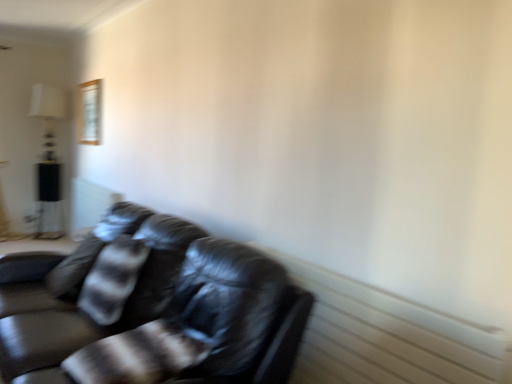
Measure the distance between point (83, 119) and camera.

The depth of point (83, 119) is 5.56 meters.

The width and height of the screenshot is (512, 384). What do you see at coordinates (89, 113) in the screenshot? I see `wooden frame at upper left` at bounding box center [89, 113].

The image size is (512, 384). I want to click on black glossy table at left, so click(x=47, y=187).

The image size is (512, 384). What do you see at coordinates (154, 309) in the screenshot? I see `shiny black leather couch at lower left` at bounding box center [154, 309].

Image resolution: width=512 pixels, height=384 pixels. What are the coordinates of `striped fabric pillow at left` in the screenshot? It's located at (94, 248).

Measure the distance between striped fabric pillow at left and camera.

The depth of striped fabric pillow at left is 2.49 meters.

The image size is (512, 384). I want to click on wooden frame at upper left, so click(89, 113).

Is shiny black leather couch at lower left far away from black glossy table at left?

shiny black leather couch at lower left is positioned a significant distance from black glossy table at left.

From the image's perspective, which is above, shiny black leather couch at lower left or black glossy table at left?

black glossy table at left, from the image's perspective.

In the image, there is a black glossy table at left. At what (x,y) coordinates should I click in order to perform the action: click on studio couch below it (from a real-world perspective). Please return your answer as a coordinate pair (x, y). This screenshot has height=384, width=512. Looking at the image, I should click on (154, 309).

From a real-world perspective, who is located higher, shiny black leather couch at lower left or black glossy table at left?

Answer: In real-world perspective, black glossy table at left is above.

How different are the orientations of black glossy table at left and wooden frame at upper left in degrees?

The facing directions of black glossy table at left and wooden frame at upper left are 56.6 degrees apart.

From a real-world perspective, is black glossy table at left located beneath wooden frame at upper left?

Yes, from a real-world perspective, black glossy table at left is under wooden frame at upper left.

Who is shorter, black glossy table at left or wooden frame at upper left?

wooden frame at upper left is shorter.

Does point (47, 170) come behind point (87, 89)?

Yes, point (47, 170) is farther from viewer.

How far apart are striped fabric pillow at left and black glossy table at left?

striped fabric pillow at left and black glossy table at left are 12.15 feet apart from each other.

Between point (57, 269) and point (46, 193), which one is positioned in front?

The point (57, 269) is closer.

Is striped fabric pillow at left next to black glossy table at left and touching it?

No.

Considering the sizes of objects striped fabric pillow at left and wooden frame at upper left in the image provided, who is shorter, striped fabric pillow at left or wooden frame at upper left?

striped fabric pillow at left.

Who is smaller, striped fabric pillow at left or wooden frame at upper left?

With smaller size is wooden frame at upper left.

Is striped fabric pillow at left surrounding wooden frame at upper left?

No, wooden frame at upper left is not surrounded by striped fabric pillow at left.

Looking at this image, how distant is striped fabric pillow at left from wooden frame at upper left?

striped fabric pillow at left and wooden frame at upper left are 8.17 feet apart.

Measure the distance between white fabric lampshade at upper left and wooden frame at upper left.

The distance of white fabric lampshade at upper left from wooden frame at upper left is 33.46 inches.

From a real-world perspective, is white fabric lampshade at upper left positioned under wooden frame at upper left based on gravity?

Yes, from a real-world perspective, white fabric lampshade at upper left is under wooden frame at upper left.

Is the surface of white fabric lampshade at upper left in direct contact with wooden frame at upper left?

They are not placed beside each other.

Is point (32, 88) less distant than point (95, 141)?

No, it is not.

Between wooden frame at upper left and shiny black leather couch at lower left, which one has larger size?

shiny black leather couch at lower left.

Is wooden frame at upper left turned away from shiny black leather couch at lower left?

wooden frame at upper left does not have its back to shiny black leather couch at lower left.

Is wooden frame at upper left inside or outside of shiny black leather couch at lower left?

wooden frame at upper left is not inside shiny black leather couch at lower left, it's outside.

From the image's perspective, is wooden frame at upper left located beneath shiny black leather couch at lower left?

Actually, wooden frame at upper left appears above shiny black leather couch at lower left in the image.

In the image, is black glossy table at left on the left side or the right side of white fabric lampshade at upper left?

black glossy table at left is positioned on white fabric lampshade at upper left's left side.

From the image's perspective, is black glossy table at left above white fabric lampshade at upper left?

Incorrect, from the image's perspective, black glossy table at left is lower than white fabric lampshade at upper left.

From a real-world perspective, is black glossy table at left under white fabric lampshade at upper left?

Indeed, from a real-world perspective, black glossy table at left is positioned beneath white fabric lampshade at upper left.

Image resolution: width=512 pixels, height=384 pixels. Find the location of `studio couch on the right of black glossy table at left`. studio couch on the right of black glossy table at left is located at coordinates (154, 309).

Locate an element on the screen. This screenshot has width=512, height=384. table below the wooden frame at upper left (from a real-world perspective) is located at coordinates (47, 187).

Based on their spatial positions, is wooden frame at upper left or striped fabric pillow at left further from black glossy table at left?

striped fabric pillow at left is positioned further to the anchor black glossy table at left.

Which object lies nearer to the anchor point shiny black leather couch at lower left, striped fabric pillow at left or wooden frame at upper left?

striped fabric pillow at left is positioned closer to the anchor shiny black leather couch at lower left.

When comparing their distances from shiny black leather couch at lower left, does black glossy table at left or white fabric lampshade at upper left seem further?

The object further to shiny black leather couch at lower left is white fabric lampshade at upper left.

Based on their spatial positions, is striped fabric pillow at left or wooden frame at upper left further from white fabric lampshade at upper left?

striped fabric pillow at left is positioned further to the anchor white fabric lampshade at upper left.

Which object lies nearer to the anchor point striped fabric pillow at left, white fabric lampshade at upper left or shiny black leather couch at lower left?

shiny black leather couch at lower left is positioned closer to the anchor striped fabric pillow at left.

From the image, which object appears to be farther from black glossy table at left, white fabric lampshade at upper left or wooden frame at upper left?

wooden frame at upper left is further to black glossy table at left.

Looking at the image, which one is located closer to shiny black leather couch at lower left, striped fabric pillow at left or white fabric lampshade at upper left?

striped fabric pillow at left lies closer to shiny black leather couch at lower left than the other object.

When comparing their distances from black glossy table at left, does shiny black leather couch at lower left or striped fabric pillow at left seem closer?

striped fabric pillow at left is positioned closer to the anchor black glossy table at left.

This screenshot has height=384, width=512. I want to click on pillow between shiny black leather couch at lower left and white fabric lampshade at upper left from front to back, so click(x=94, y=248).

You are a GUI agent. You are given a task and a screenshot of the screen. Output one action in this format:
    pyautogui.click(x=<x>, y=<y>)
    Task: Click on the picture frame located between striped fabric pillow at left and black glossy table at left in the depth direction
    Image resolution: width=512 pixels, height=384 pixels.
    Given the screenshot: What is the action you would take?
    pyautogui.click(x=89, y=113)

The width and height of the screenshot is (512, 384). In order to click on picture frame between shiny black leather couch at lower left and black glossy table at left from front to back in this screenshot , I will do `click(89, 113)`.

At what (x,y) coordinates should I click in order to perform the action: click on lamp between wooden frame at upper left and black glossy table at left from top to bottom. Please return your answer as a coordinate pair (x, y). This screenshot has height=384, width=512. Looking at the image, I should click on (48, 114).